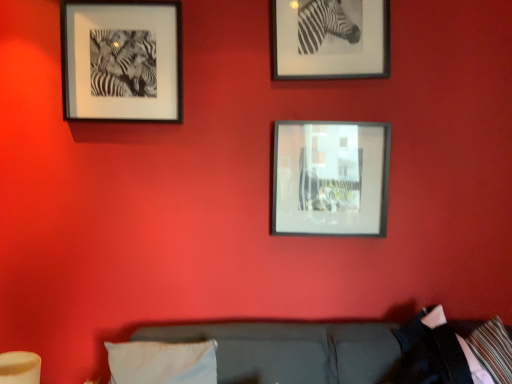
Question: Considering the relative sizes of metallic silver frame at center, arranged as the third picture frame when viewed from the left, and metallic silver frame at upper right, the 2th picture frame from the right, in the image provided, is metallic silver frame at center, arranged as the third picture frame when viewed from the left, taller than metallic silver frame at upper right, the 2th picture frame from the right,?

Choices:
 (A) yes
 (B) no

Answer: (A)

Question: From the image's perspective, is metallic silver frame at center, the 1th picture frame positioned from the right, above metallic silver frame at upper right, marked as the second picture frame in a left-to-right arrangement?

Choices:
 (A) no
 (B) yes

Answer: (A)

Question: From the image's perspective, is metallic silver frame at center, arranged as the third picture frame when viewed from the left, under metallic silver frame at upper right, marked as the second picture frame in a left-to-right arrangement?

Choices:
 (A) yes
 (B) no

Answer: (A)

Question: Could you tell me if metallic silver frame at center, the 1th picture frame positioned from the right, is facing metallic silver frame at upper right, the 2th picture frame from the right?

Choices:
 (A) no
 (B) yes

Answer: (A)

Question: Does metallic silver frame at center, the 1th picture frame positioned from the right, have a lesser height compared to metallic silver frame at upper right, the 2th picture frame from the right?

Choices:
 (A) no
 (B) yes

Answer: (A)

Question: Looking at the image, does metallic silver frame at center, the 1th picture frame positioned from the right, seem bigger or smaller compared to black matte picture frame at upper left, acting as the first picture frame starting from the left?

Choices:
 (A) big
 (B) small

Answer: (B)

Question: Considering the positions of metallic silver frame at center, arranged as the third picture frame when viewed from the left, and black matte picture frame at upper left, acting as the first picture frame starting from the left, in the image, is metallic silver frame at center, arranged as the third picture frame when viewed from the left, wider or thinner than black matte picture frame at upper left, acting as the first picture frame starting from the left,?

Choices:
 (A) thin
 (B) wide

Answer: (A)

Question: Considering the positions of point (347, 125) and point (86, 13), is point (347, 125) closer or farther from the camera than point (86, 13)?

Choices:
 (A) closer
 (B) farther

Answer: (B)

Question: From a real-world perspective, is metallic silver frame at center, arranged as the third picture frame when viewed from the left, positioned above or below black matte picture frame at upper left, acting as the first picture frame starting from the left?

Choices:
 (A) above
 (B) below

Answer: (B)

Question: Would you say white fabric pillow at lower center is to the left or to the right of metallic silver frame at center, the 1th picture frame positioned from the right, in the picture?

Choices:
 (A) left
 (B) right

Answer: (A)

Question: Considering the positions of white fabric pillow at lower center and metallic silver frame at center, arranged as the third picture frame when viewed from the left, in the image, is white fabric pillow at lower center bigger or smaller than metallic silver frame at center, arranged as the third picture frame when viewed from the left,?

Choices:
 (A) small
 (B) big

Answer: (B)

Question: Is white fabric pillow at lower center situated inside metallic silver frame at center, arranged as the third picture frame when viewed from the left, or outside?

Choices:
 (A) inside
 (B) outside

Answer: (B)

Question: In terms of height, does white fabric pillow at lower center look taller or shorter compared to metallic silver frame at center, arranged as the third picture frame when viewed from the left?

Choices:
 (A) tall
 (B) short

Answer: (B)

Question: Based on their sizes in the image, would you say metallic silver frame at center, arranged as the third picture frame when viewed from the left, is bigger or smaller than white fabric pillow at lower center?

Choices:
 (A) big
 (B) small

Answer: (B)

Question: Is metallic silver frame at center, the 1th picture frame positioned from the right, inside the boundaries of white fabric pillow at lower center, or outside?

Choices:
 (A) inside
 (B) outside

Answer: (B)